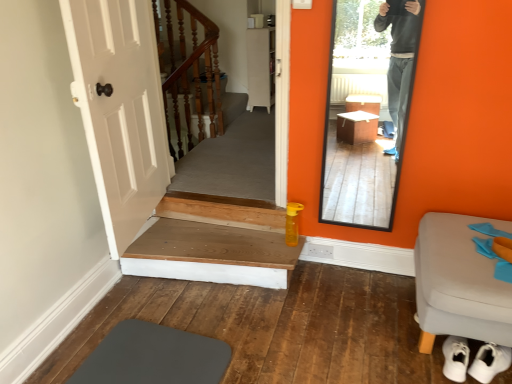
Question: From the image's perspective, is white fabric stool at lower right located above wooden at upper left, arranged as the 1th stairs when viewed from the back?

Choices:
 (A) yes
 (B) no

Answer: (B)

Question: From a real-world perspective, is white fabric stool at lower right over wooden at upper left, the 2th stairs from the bottom?

Choices:
 (A) yes
 (B) no

Answer: (B)

Question: Can you confirm if white fabric stool at lower right is shorter than wooden at upper left, which is the 1th stairs in top-to-bottom order?

Choices:
 (A) yes
 (B) no

Answer: (A)

Question: Can you confirm if white fabric stool at lower right is wider than wooden at upper left, arranged as the 1th stairs when viewed from the back?

Choices:
 (A) yes
 (B) no

Answer: (A)

Question: Does white fabric stool at lower right turn towards wooden at upper left, which is counted as the second stairs, starting from the front?

Choices:
 (A) yes
 (B) no

Answer: (B)

Question: Do you think white matte cabinet at center is within wooden at upper left, which is counted as the second stairs, starting from the front, or outside of it?

Choices:
 (A) inside
 (B) outside

Answer: (B)

Question: Is white matte cabinet at center bigger or smaller than wooden at upper left, arranged as the 1th stairs when viewed from the back?

Choices:
 (A) big
 (B) small

Answer: (A)

Question: From a real-world perspective, is white matte cabinet at center above or below wooden at upper left, arranged as the 1th stairs when viewed from the back?

Choices:
 (A) below
 (B) above

Answer: (A)

Question: Considering the positions of white matte cabinet at center and wooden at upper left, which is the 1th stairs in top-to-bottom order, in the image, is white matte cabinet at center taller or shorter than wooden at upper left, which is the 1th stairs in top-to-bottom order,?

Choices:
 (A) short
 (B) tall

Answer: (A)

Question: Is wooden at upper left, which is the 1th stairs in top-to-bottom order, wider or thinner than clear glass mirror at right?

Choices:
 (A) wide
 (B) thin

Answer: (A)

Question: Choose the correct answer: Is wooden at upper left, which is the 1th stairs in top-to-bottom order, inside clear glass mirror at right or outside it?

Choices:
 (A) outside
 (B) inside

Answer: (A)

Question: Is point (199, 76) closer or farther from the camera than point (396, 44)?

Choices:
 (A) closer
 (B) farther

Answer: (B)

Question: From a real-world perspective, is wooden at upper left, arranged as the 1th stairs when viewed from the back, physically located above or below clear glass mirror at right?

Choices:
 (A) above
 (B) below

Answer: (A)

Question: Relative to wooden at upper left, arranged as the 1th stairs when viewed from the back, is wooden at bottom, placed as the 1th stairs when sorted from bottom to top, in front or behind?

Choices:
 (A) front
 (B) behind

Answer: (A)

Question: Is wooden at bottom, placed as the 1th stairs when sorted from bottom to top, taller or shorter than wooden at upper left, the 2th stairs from the bottom?

Choices:
 (A) short
 (B) tall

Answer: (A)